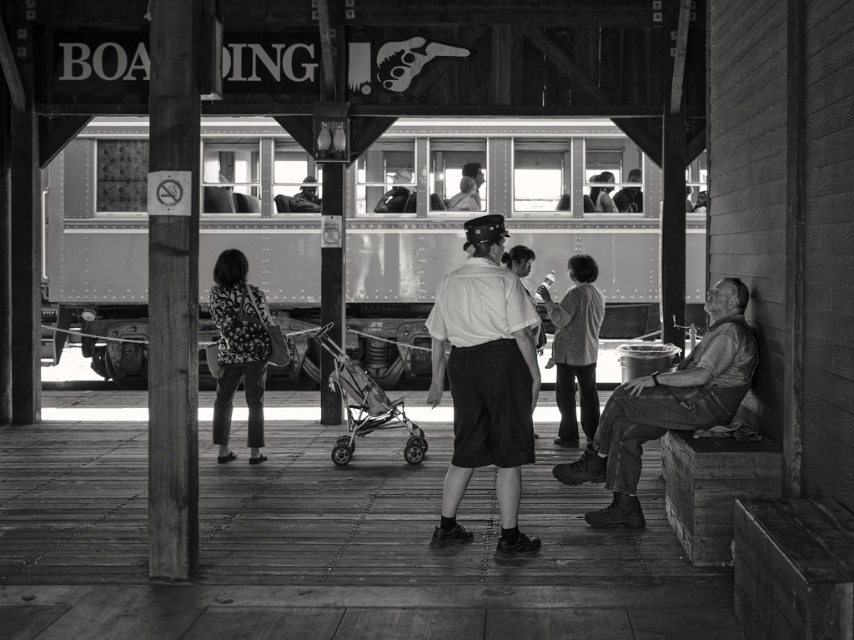
Is floral-patterned fabric at center closer to camera compared to light gray sweater at center?

Yes, it is in front of light gray sweater at center.

Does point (262, 394) lie in front of point (572, 296)?

Yes, it is in front of point (572, 296).

You are a GUI agent. You are given a task and a screenshot of the screen. Output one action in this format:
    pyautogui.click(x=<x>, y=<y>)
    Task: Click on the floral-patterned fabric at center
    
    Given the screenshot: What is the action you would take?
    pyautogui.click(x=238, y=352)

Does point (227, 417) come in front of point (344, 378)?

Yes, point (227, 417) is in front of point (344, 378).

What do you see at coordinates (238, 352) in the screenshot? The width and height of the screenshot is (854, 640). I see `floral-patterned fabric at center` at bounding box center [238, 352].

What do you see at coordinates (238, 352) in the screenshot? This screenshot has height=640, width=854. I see `floral-patterned fabric at center` at bounding box center [238, 352].

Locate an element on the screen. The width and height of the screenshot is (854, 640). floral-patterned fabric at center is located at coordinates (238, 352).

Looking at this image, who is more distant from viewer, (x=361, y=272) or (x=364, y=403)?

Point (x=361, y=272)

Between smooth metal train at center and metallic silver stroller at center, which one is positioned lower?

metallic silver stroller at center is lower down.

Between point (73, 220) and point (393, 413), which one is positioned behind?

Positioned behind is point (73, 220).

In order to click on smooth metal train at center in this screenshot , I will do `click(501, 205)`.